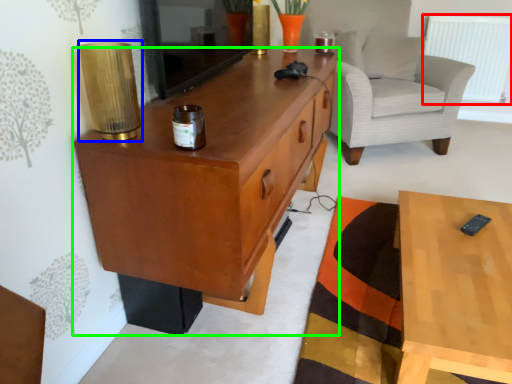
Question: Considering the real-world distances, which object is closest to radiator (highlighted by a red box)? lamp (highlighted by a blue box) or cabinetry (highlighted by a green box).

Choices:
 (A) lamp
 (B) cabinetry

Answer: (B)